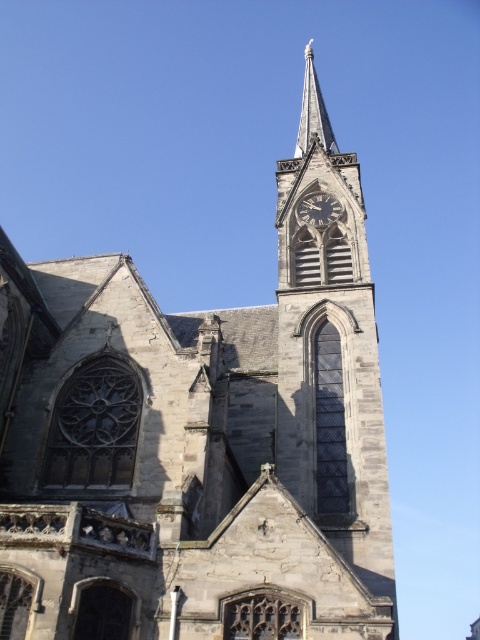
You are an architect assessing the church facade. You need to install a new decorative element between the gray stone spire at upper center and the dark gray stone clock at center. Which object should you place closer to the center of the facade to maintain symmetry?

The gray stone spire at upper center has a larger width than the dark gray stone clock at center. To maintain symmetry, place the decorative element closer to the dark gray stone clock at center since it is narrower and requires balancing the wider spire.

You are standing in front of the historic stone church and want to take a photo of the gray stone spire at upper center. If you are exactly 236.43 feet away from it, will you be able to capture the entire spire in your camera frame without moving closer?

The gray stone spire at upper center is 236.43 feet away from the viewer. Whether you can capture the entire spire depends on your camera lens. A standard lens might require being closer, but a telephoto lens could potentially capture it from that distance.